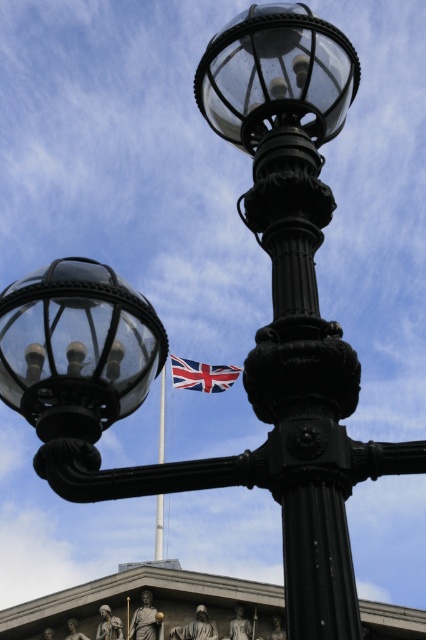
Question: Which object is the closest to the matte glass streetlamp at upper center?

Choices:
 (A) red and white striped fabric at center
 (B) metallic flag pole at center

Answer: (B)

Question: Is matte glass streetlamp at upper center to the left of metallic flag pole at center from the viewer's perspective?

Choices:
 (A) yes
 (B) no

Answer: (B)

Question: Which of these objects is positioned closest to the matte glass streetlamp at upper center?

Choices:
 (A) red and white striped fabric at center
 (B) metallic flag pole at center

Answer: (B)

Question: Which point appears farthest from the camera in this image?

Choices:
 (A) click(x=160, y=506)
 (B) click(x=2, y=376)

Answer: (A)

Question: Does red and white striped fabric at center have a larger size compared to metallic flag pole at center?

Choices:
 (A) yes
 (B) no

Answer: (B)

Question: Is red and white striped fabric at center positioned in front of metallic flag pole at center?

Choices:
 (A) yes
 (B) no

Answer: (B)